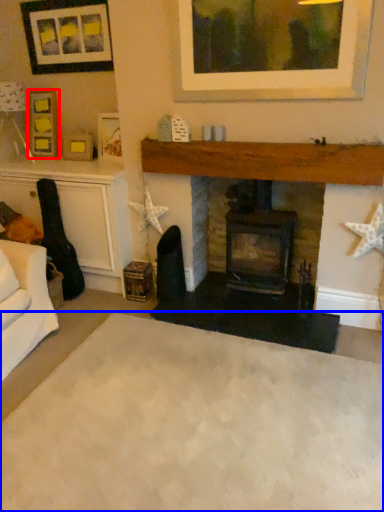
Question: Which object is closer to the camera taking this photo, picture frame (highlighted by a red box) or plain (highlighted by a blue box)?

Choices:
 (A) picture frame
 (B) plain

Answer: (B)